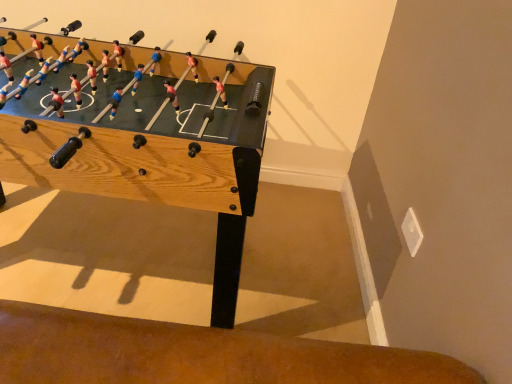
Locate an element on the screen. wooden foosball table at center is located at coordinates (160, 155).

Image resolution: width=512 pixels, height=384 pixels. What do you see at coordinates (160, 155) in the screenshot? I see `wooden foosball table at center` at bounding box center [160, 155].

Where is `wooden foosball table at center`? wooden foosball table at center is located at coordinates (160, 155).